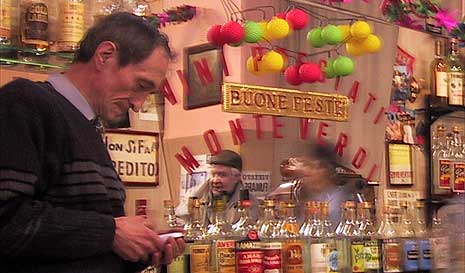
Image resolution: width=465 pixels, height=273 pixels. I want to click on bottles, so click(x=374, y=250).